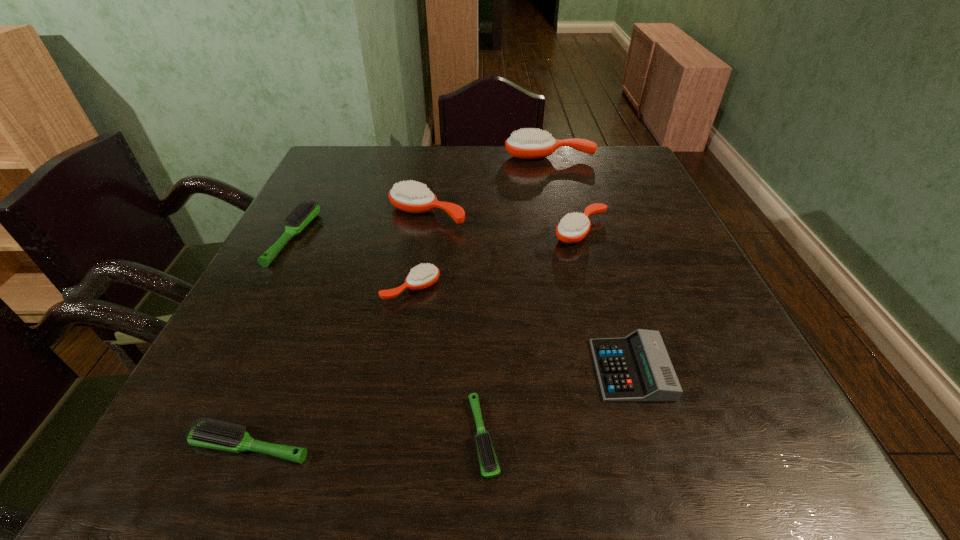
Identify the location of light hairbrush that stands as the second closest to the farthest light hairbrush. (490, 468).

You are a GUI agent. You are given a task and a screenshot of the screen. Output one action in this format:
    pyautogui.click(x=<x>, y=<y>)
    Task: Click on the free region that satisfies the following two spatial constraints: 1. on the back side of the second shortest hairbrush; 2. on the left side of the smallest orange hairbrush
    This screenshot has height=540, width=960.
    Given the screenshot: What is the action you would take?
    pyautogui.click(x=315, y=288)

Locate an element on the screen. This screenshot has height=540, width=960. vacant space that satisfies the following two spatial constraints: 1. on the back side of the second shortest hairbrush; 2. on the left side of the calculator is located at coordinates (281, 370).